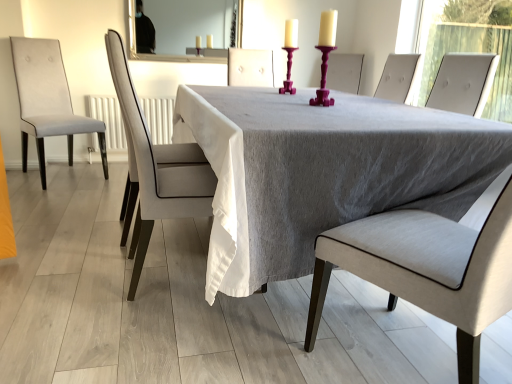
Question: Is white glossy mirror at upper center located within gray fabric table at center?

Choices:
 (A) yes
 (B) no

Answer: (B)

Question: Can you confirm if gray fabric table at center is taller than white glossy mirror at upper center?

Choices:
 (A) yes
 (B) no

Answer: (A)

Question: From a real-world perspective, is gray fabric table at center positioned under white glossy mirror at upper center based on gravity?

Choices:
 (A) no
 (B) yes

Answer: (B)

Question: Can you confirm if gray fabric table at center is shorter than white glossy mirror at upper center?

Choices:
 (A) no
 (B) yes

Answer: (A)

Question: Is gray fabric table at center far away from white glossy mirror at upper center?

Choices:
 (A) no
 (B) yes

Answer: (B)

Question: Is light gray fabric chair at left, acting as the third chair starting from the front, in front of or behind white glossy mirror at upper center in the image?

Choices:
 (A) front
 (B) behind

Answer: (A)

Question: From the image's perspective, is light gray fabric chair at left, acting as the 1th chair starting from the back, positioned above or below white glossy mirror at upper center?

Choices:
 (A) below
 (B) above

Answer: (A)

Question: From a real-world perspective, relative to white glossy mirror at upper center, is light gray fabric chair at left, acting as the third chair starting from the front, vertically above or below?

Choices:
 (A) above
 (B) below

Answer: (B)

Question: Choose the correct answer: Is light gray fabric chair at left, acting as the third chair starting from the front, inside white glossy mirror at upper center or outside it?

Choices:
 (A) outside
 (B) inside

Answer: (A)

Question: From the image's perspective, is light gray fabric chair at left, acting as the 1th chair starting from the back, located above or below light gray fabric chair at center, positioned as the 1th chair in right-to-left order?

Choices:
 (A) above
 (B) below

Answer: (A)

Question: Is light gray fabric chair at left, positioned as the first chair in left-to-right order, in front of or behind light gray fabric chair at center, the 3th chair from the left, in the image?

Choices:
 (A) front
 (B) behind

Answer: (B)

Question: Considering the positions of light gray fabric chair at left, acting as the 1th chair starting from the back, and light gray fabric chair at center, the 3th chair from the left, in the image, is light gray fabric chair at left, acting as the 1th chair starting from the back, wider or thinner than light gray fabric chair at center, the 3th chair from the left,?

Choices:
 (A) thin
 (B) wide

Answer: (B)

Question: From a real-world perspective, relative to light gray fabric chair at center, positioned as the 1th chair in right-to-left order, is light gray fabric chair at left, positioned as the first chair in left-to-right order, vertically above or below?

Choices:
 (A) above
 (B) below

Answer: (A)

Question: From a real-world perspective, is light gray fabric chair at center, which ranks as the first chair in front-to-back order, physically located above or below light gray fabric chair at center, which is counted as the second chair, starting from the right?

Choices:
 (A) above
 (B) below

Answer: (B)

Question: Is light gray fabric chair at center, which ranks as the first chair in front-to-back order, inside or outside of light gray fabric chair at center, which ranks as the second chair in front-to-back order?

Choices:
 (A) outside
 (B) inside

Answer: (A)